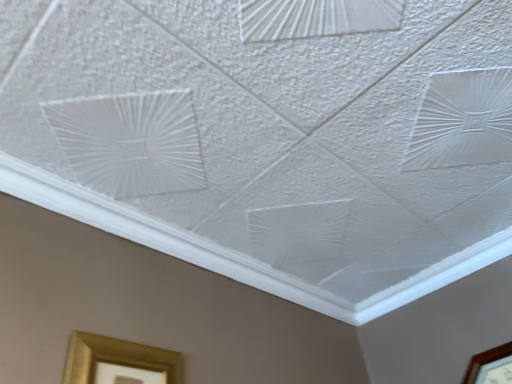
Question: Looking at their shapes, would you say brown wooden picture frame at lower right, the 2th picture frame when ordered from left to right, is wider or thinner than gold metallic picture frame at lower left, placed as the second picture frame when sorted from right to left?

Choices:
 (A) thin
 (B) wide

Answer: (B)

Question: From a real-world perspective, is brown wooden picture frame at lower right, acting as the first picture frame starting from the right, physically located above or below gold metallic picture frame at lower left, which is counted as the second picture frame, starting from the back?

Choices:
 (A) below
 (B) above

Answer: (B)

Question: Is brown wooden picture frame at lower right, the first picture frame in the back-to-front sequence, inside or outside of gold metallic picture frame at lower left, positioned as the 1th picture frame in front-to-back order?

Choices:
 (A) inside
 (B) outside

Answer: (B)

Question: Which is correct: gold metallic picture frame at lower left, positioned as the 1th picture frame in front-to-back order, is inside brown wooden picture frame at lower right, the second picture frame in the front-to-back sequence, or outside of it?

Choices:
 (A) outside
 (B) inside

Answer: (A)

Question: From the image's perspective, is gold metallic picture frame at lower left, which is counted as the second picture frame, starting from the back, located above or below brown wooden picture frame at lower right, the first picture frame in the back-to-front sequence?

Choices:
 (A) below
 (B) above

Answer: (B)

Question: In the image, is gold metallic picture frame at lower left, positioned as the 1th picture frame in front-to-back order, positioned in front of or behind brown wooden picture frame at lower right, acting as the first picture frame starting from the right?

Choices:
 (A) front
 (B) behind

Answer: (A)

Question: Is point (84, 349) positioned closer to the camera than point (482, 352)?

Choices:
 (A) farther
 (B) closer

Answer: (B)